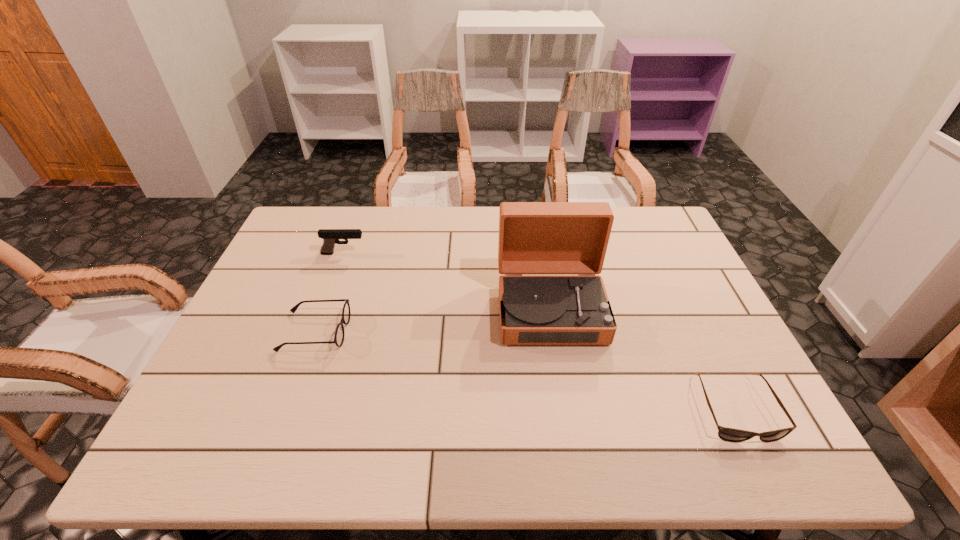
The height and width of the screenshot is (540, 960). Find the location of `object that can be found as the third closest to the second tallest object`. object that can be found as the third closest to the second tallest object is located at coordinates (726, 434).

Choose which object is the nearest neighbor to the rightmost object. Please provide its 2D coordinates. Your answer should be formatted as a tuple, i.e. [(x, y)], where the tuple contains the x and y coordinates of a point satisfying the conditions above.

[(534, 237)]

At what (x,y) coordinates should I click in order to perform the action: click on free spot that satisfies the following two spatial constraints: 1. on the face of the phonograph record; 2. on the front-facing side of the spectacles. Please return your answer as a coordinate pair (x, y). Looking at the image, I should click on (554, 332).

Identify the location of vacant position in the image that satisfies the following two spatial constraints: 1. on the face of the third object from left to right; 2. on the front-facing side of the spectacles. (554, 332).

Locate an element on the screen. The image size is (960, 540). free region that satisfies the following two spatial constraints: 1. on the face of the third object from left to right; 2. on the front-facing side of the second shortest object is located at coordinates (554, 332).